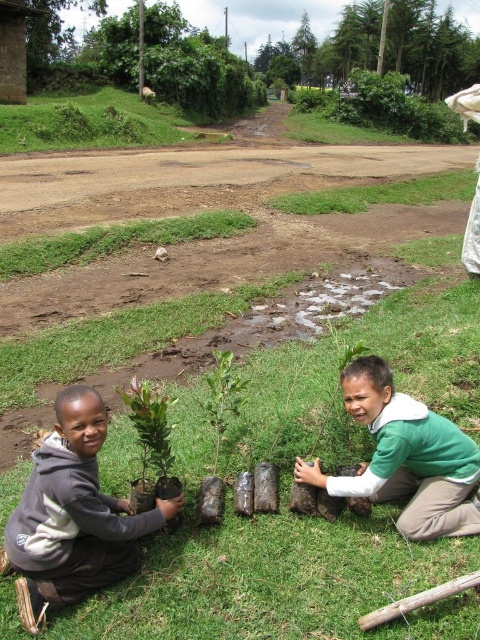
Can you confirm if green leafy tree at upper center is bigger than green matte plant at center?

Indeed, green leafy tree at upper center has a larger size compared to green matte plant at center.

Locate an element on the screen. green leafy tree at upper center is located at coordinates (383, 48).

This screenshot has height=640, width=480. What do you see at coordinates (152, 433) in the screenshot?
I see `green matte plant at center` at bounding box center [152, 433].

Image resolution: width=480 pixels, height=640 pixels. What do you see at coordinates (152, 433) in the screenshot?
I see `green matte plant at center` at bounding box center [152, 433].

This screenshot has width=480, height=640. Identify the location of green matte plant at center. pyautogui.click(x=152, y=433).

Does dark gray hoodie at lower left have a lesser width compared to green leafy tree at upper center?

Yes, dark gray hoodie at lower left is thinner than green leafy tree at upper center.

Who is higher up, dark gray hoodie at lower left or green leafy tree at upper center?

green leafy tree at upper center is higher up.

Which is behind, point (100, 588) or point (389, 42)?

Point (389, 42)

The height and width of the screenshot is (640, 480). I want to click on dark gray hoodie at lower left, so click(72, 515).